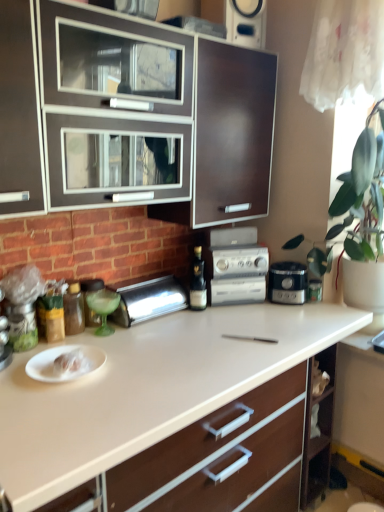
Locate an element on the screen. unoccupied region to the right of satin black coffee maker at center is located at coordinates (336, 307).